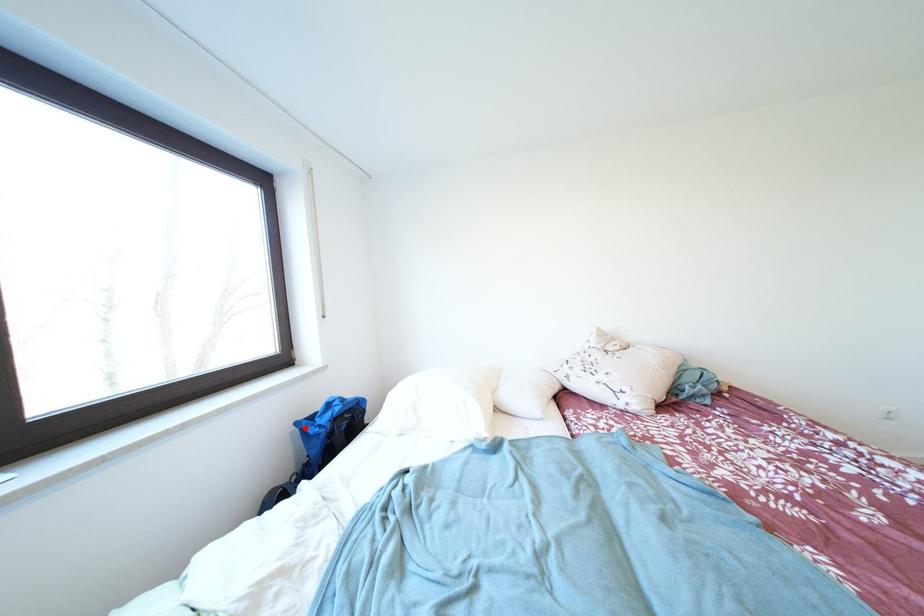
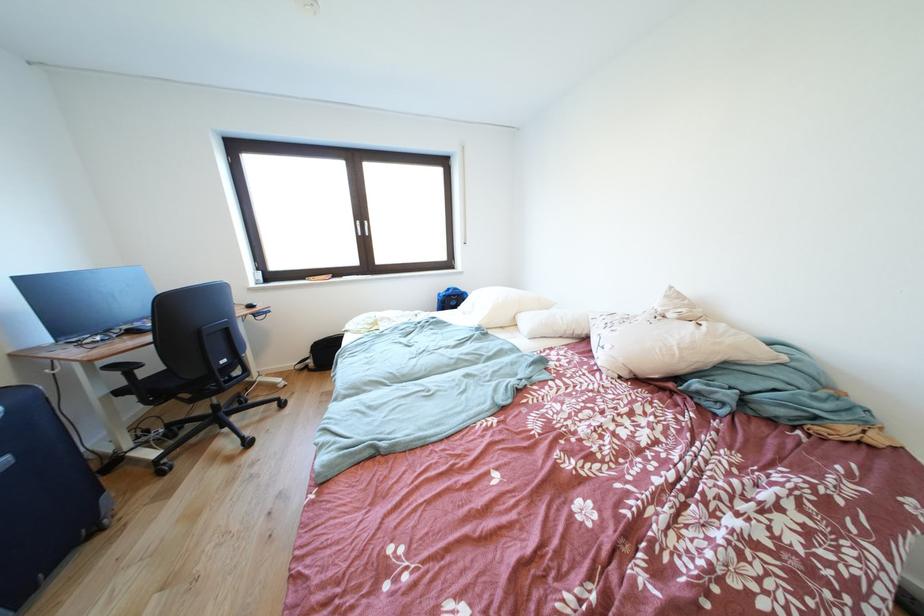
Locate, in the second image, the point that corresponds to the highlighted location in the first image.

(447, 299)